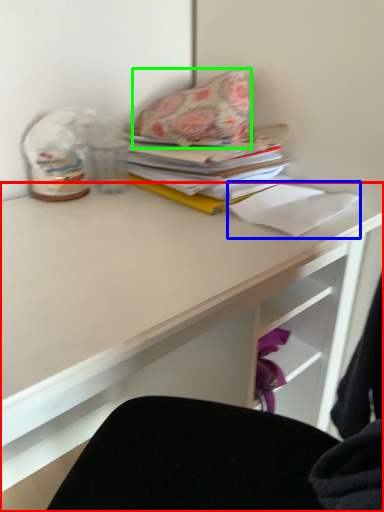
Question: Based on their relative distances, which object is nearer to desk (highlighted by a red box)? Choose from paper (highlighted by a blue box) and throw pillow (highlighted by a green box).

Choices:
 (A) paper
 (B) throw pillow

Answer: (A)